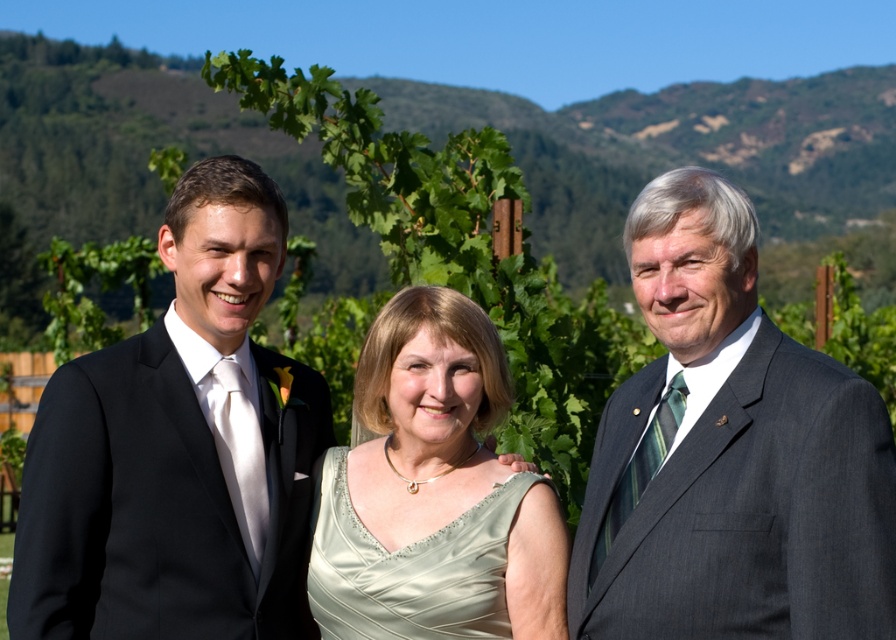
Question: Can you confirm if black satin suit at left is wider than satin green dress at center?

Choices:
 (A) no
 (B) yes

Answer: (B)

Question: Which point appears farthest from the camera in this image?

Choices:
 (A) (651, 288)
 (B) (461, 588)
 (C) (410, 593)

Answer: (C)

Question: Which point appears closest to the camera in this image?

Choices:
 (A) (605, 550)
 (B) (367, 545)
 (C) (195, 196)
 (D) (328, 568)

Answer: (A)

Question: Can you confirm if black satin suit at left is smaller than satin dress at center?

Choices:
 (A) no
 (B) yes

Answer: (A)

Question: Among these points, which one is nearest to the camera?

Choices:
 (A) (458, 589)
 (B) (725, 234)
 (C) (252, 186)
 (D) (419, 580)

Answer: (B)

Question: Is black satin suit at left closer to camera compared to satin dress at center?

Choices:
 (A) yes
 (B) no

Answer: (A)